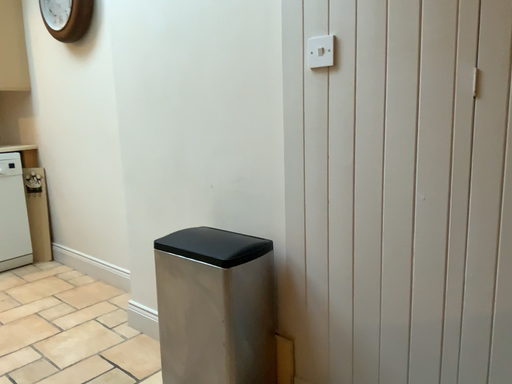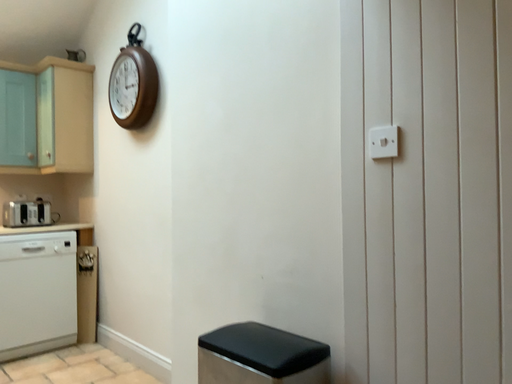
Question: How did the camera likely rotate when shooting the video?

Choices:
 (A) rotated upward
 (B) rotated downward

Answer: (A)